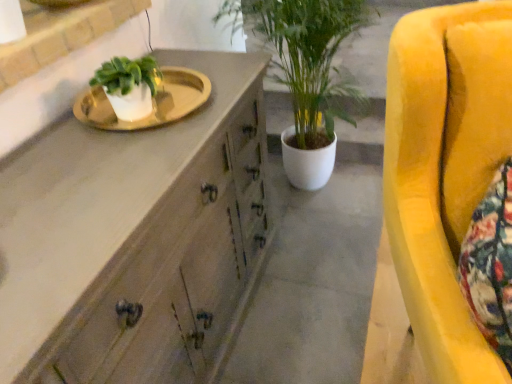
Locate an element on the screen. The height and width of the screenshot is (384, 512). free space in front of white glossy sink at upper left is located at coordinates (123, 154).